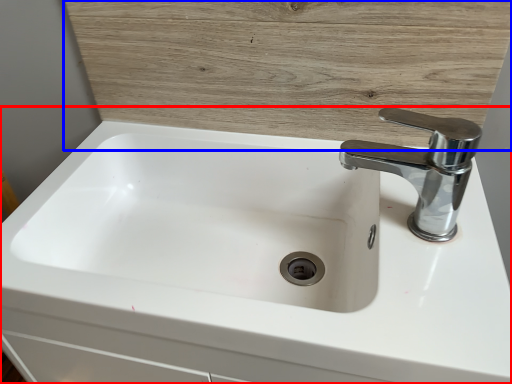
Question: Which point is closer to the camera, sink (highlighted by a red box) or wood (highlighted by a blue box)?

Choices:
 (A) sink
 (B) wood

Answer: (A)